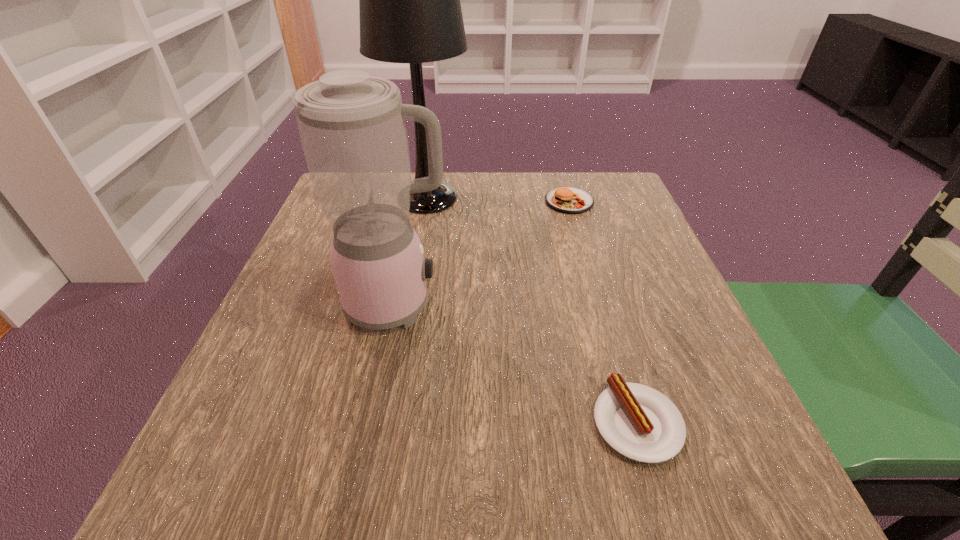
Image resolution: width=960 pixels, height=540 pixels. I want to click on table lamp located in the far edge section of the desktop, so click(x=410, y=12).

At what (x,y) coordinates should I click in order to perform the action: click on patty situated at the far edge. Please return your answer as a coordinate pair (x, y). The image size is (960, 540). Looking at the image, I should click on (570, 200).

Locate an element on the screen. The height and width of the screenshot is (540, 960). object present at the near edge is located at coordinates (639, 422).

Where is `table lamp that is at the left edge`? Image resolution: width=960 pixels, height=540 pixels. table lamp that is at the left edge is located at coordinates (410, 12).

Where is `food processor situated at the left edge`? Image resolution: width=960 pixels, height=540 pixels. food processor situated at the left edge is located at coordinates (352, 127).

Identify the location of patty at the right edge. Image resolution: width=960 pixels, height=540 pixels. (570, 200).

In order to click on sausage located at the right edge in this screenshot , I will do `click(639, 422)`.

At what (x,y) coordinates should I click in order to perform the action: click on object present at the far left corner. Please return your answer as a coordinate pair (x, y). The width and height of the screenshot is (960, 540). Looking at the image, I should click on (410, 12).

The image size is (960, 540). In order to click on object that is at the far right corner in this screenshot , I will do `click(570, 200)`.

This screenshot has height=540, width=960. In order to click on object present at the near right corner in this screenshot , I will do `click(639, 422)`.